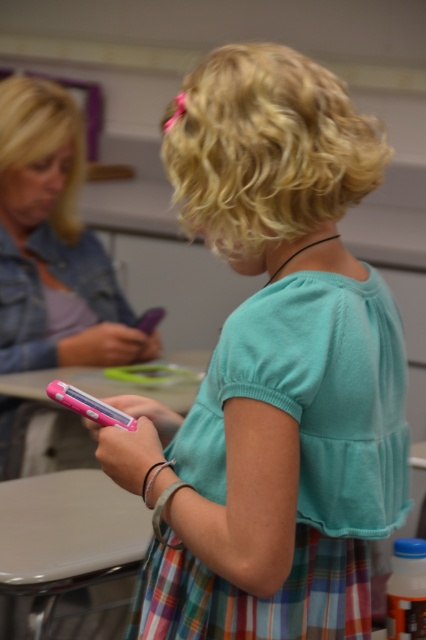
Question: From the image, what is the correct spatial relationship of matte teal shirt at center in relation to matte pink phone at left?

Choices:
 (A) below
 (B) above

Answer: (A)

Question: Which object appears farthest from the camera in this image?

Choices:
 (A) matte teal shirt at center
 (B) matte pink phone at left

Answer: (B)

Question: Which object is farther from the camera taking this photo?

Choices:
 (A) matte teal shirt at center
 (B) matte pink phone at left

Answer: (B)

Question: Does matte teal shirt at center have a larger size compared to matte pink phone at left?

Choices:
 (A) no
 (B) yes

Answer: (A)

Question: Is matte teal shirt at center above matte pink phone at left?

Choices:
 (A) yes
 (B) no

Answer: (B)

Question: Which of the following is the farthest from the observer?

Choices:
 (A) matte teal shirt at center
 (B) matte pink phone at left

Answer: (B)